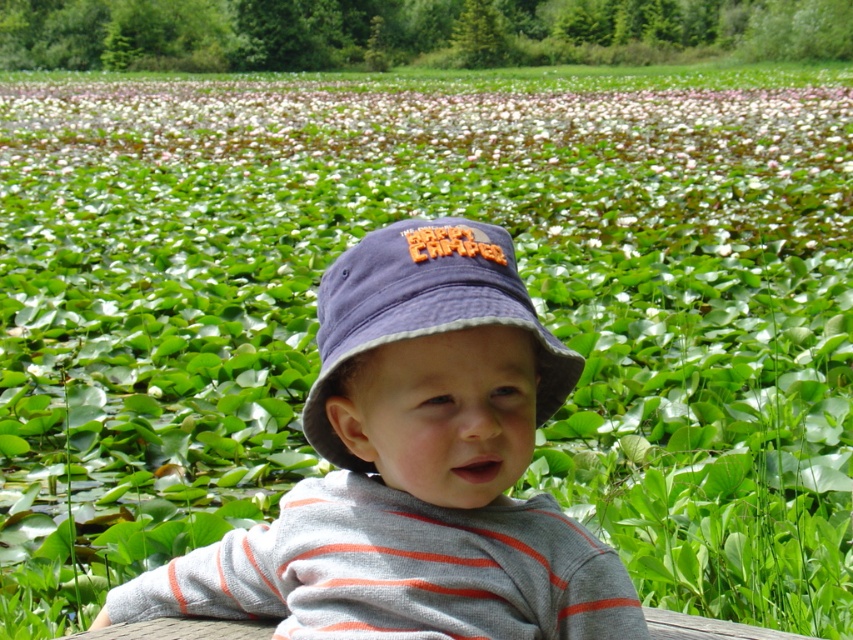
Question: Which is nearer to the navy blue fabric bucket hat at center?

Choices:
 (A) green leafy plant at upper center
 (B) matte blue bucket hat at center

Answer: (B)

Question: Among these points, which one is nearest to the camera?

Choices:
 (A) (325, 272)
 (B) (184, 145)

Answer: (A)

Question: Can you confirm if green leafy plant at upper center is positioned above navy blue fabric bucket hat at center?

Choices:
 (A) yes
 (B) no

Answer: (A)

Question: Does matte blue bucket hat at center appear over navy blue fabric bucket hat at center?

Choices:
 (A) no
 (B) yes

Answer: (A)

Question: Which object appears farthest from the camera in this image?

Choices:
 (A) navy blue fabric bucket hat at center
 (B) green leafy plant at upper center

Answer: (B)

Question: Does matte blue bucket hat at center have a lesser width compared to green leafy plant at upper center?

Choices:
 (A) no
 (B) yes

Answer: (B)